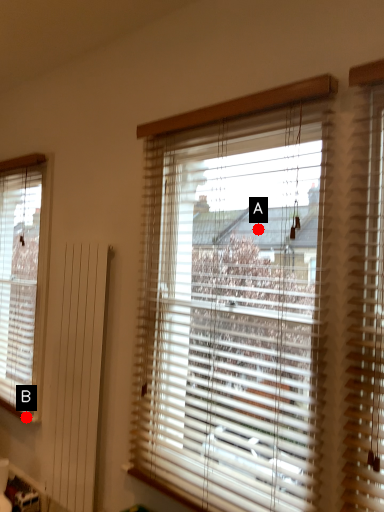
Question: Two points are circled on the image, labeled by A and B beside each circle. Which point is closer to the camera taking this photo?

Choices:
 (A) A is closer
 (B) B is closer

Answer: (A)